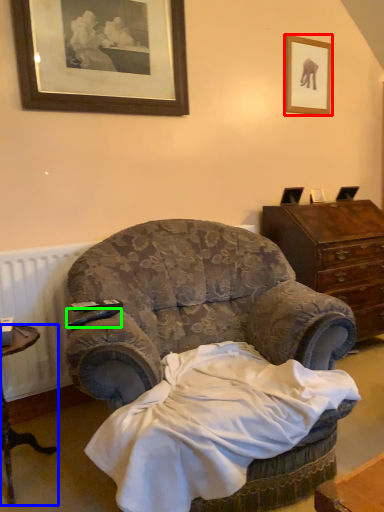
Question: Based on their relative distances, which object is nearer to picture frame (highlighted by a red box)? Choose from desk (highlighted by a blue box) and remote control (highlighted by a green box).

Choices:
 (A) desk
 (B) remote control

Answer: (B)